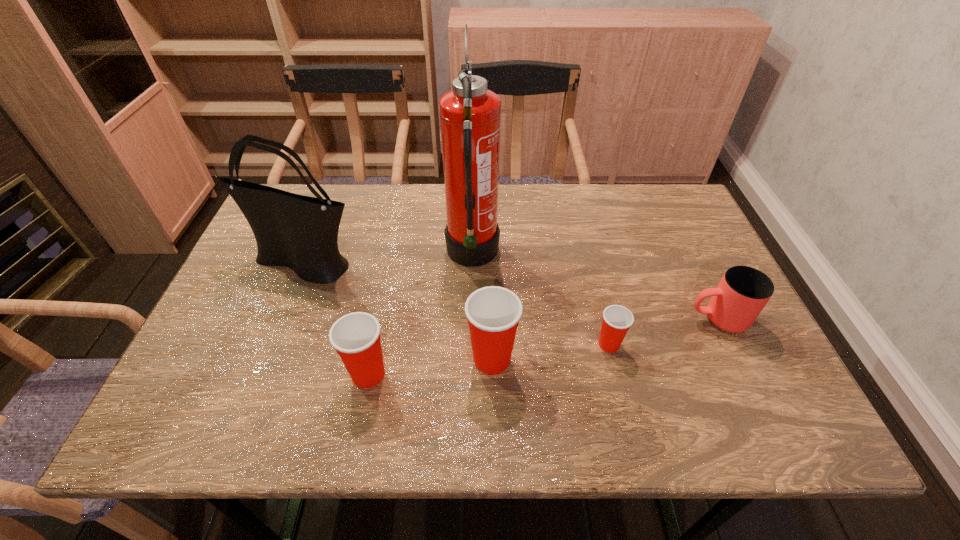
You are a GUI agent. You are given a task and a screenshot of the screen. Output one action in this format:
    pyautogui.click(x=<x>, y=<y>)
    Task: Click on the vacant space in between the fifth tallest object and the fire extinguisher
    This screenshot has width=960, height=540.
    Given the screenshot: What is the action you would take?
    pyautogui.click(x=595, y=287)

The image size is (960, 540). Identify the location of vacant point located between the second Dixie cup from right to left and the fifth object from left to right. (550, 352).

Choose which object is the nearest neighbor to the second tallest Dixie cup. Please provide its 2D coordinates. Your answer should be formatted as a tuple, i.e. [(x, y)], where the tuple contains the x and y coordinates of a point satisfying the conditions above.

[(493, 313)]

You are a GUI agent. You are given a task and a screenshot of the screen. Output one action in this format:
    pyautogui.click(x=<x>, y=<y>)
    Task: Click on the second closest object to the tallest object
    Image resolution: width=960 pixels, height=540 pixels.
    Given the screenshot: What is the action you would take?
    pyautogui.click(x=300, y=232)

Identify which Dixie cup is the second nearest to the second Dixie cup from left to right. Please provide its 2D coordinates. Your answer should be formatted as a tuple, i.e. [(x, y)], where the tuple contains the x and y coordinates of a point satisfying the conditions above.

[(617, 320)]

The width and height of the screenshot is (960, 540). Find the location of `Dixie cup that is the second closest to the fifth tallest object`. Dixie cup that is the second closest to the fifth tallest object is located at coordinates click(493, 313).

Where is `free point that satisfies the following two spatial constraints: 1. on the front-facing side of the fire extinguisher; 2. on the handle side of the rightmost object`? free point that satisfies the following two spatial constraints: 1. on the front-facing side of the fire extinguisher; 2. on the handle side of the rightmost object is located at coordinates (471, 319).

Find the location of a particular element. The image size is (960, 540). free space that satisfies the following two spatial constraints: 1. on the front side of the second Dixie cup from right to left; 2. on the left side of the leftmost object is located at coordinates (268, 359).

What are the coordinates of `blank space that satisfies the following two spatial constraints: 1. on the front side of the second tallest Dixie cup; 2. on the left side of the leftmost object` in the screenshot? It's located at (262, 374).